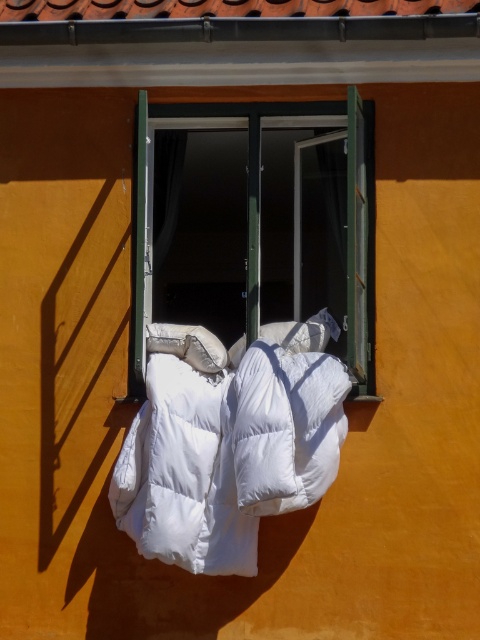
Question: Which point is closer to the camera?

Choices:
 (A) white down-filled blanket at center
 (B) green plastic window at center

Answer: (A)

Question: Can you confirm if green plastic window at center is thinner than white down-filled sleeping bag at center?

Choices:
 (A) no
 (B) yes

Answer: (A)

Question: Among these points, which one is nearest to the camera?

Choices:
 (A) (159, 381)
 (B) (356, 196)
 (C) (311, 500)

Answer: (B)

Question: Is green plastic window at center closer to camera compared to white down-filled blanket at center?

Choices:
 (A) yes
 (B) no

Answer: (B)

Question: Which of the following is the farthest from the observer?

Choices:
 (A) green plastic window at center
 (B) white down-filled sleeping bag at center

Answer: (A)

Question: Can you confirm if green plastic window at center is positioned below white down-filled sleeping bag at center?

Choices:
 (A) yes
 (B) no

Answer: (B)